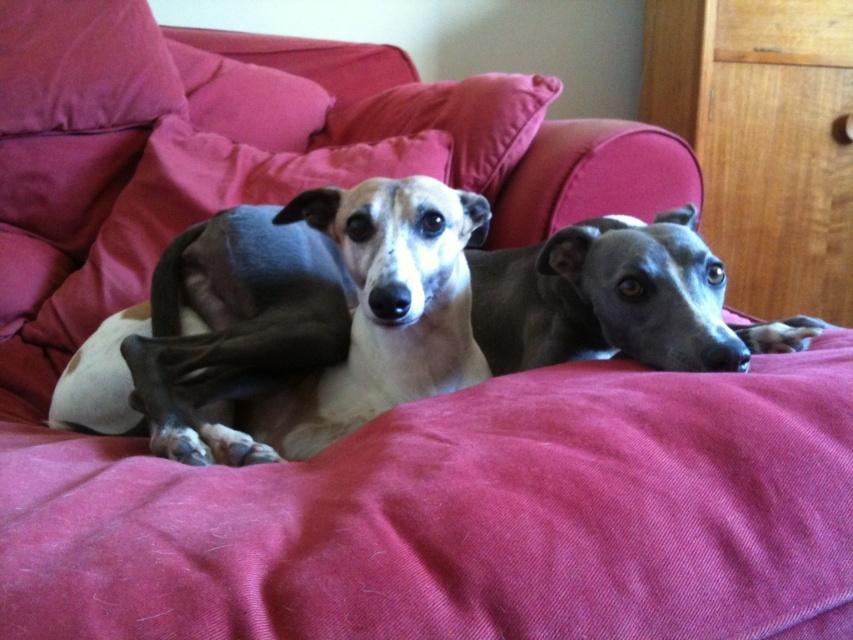
Consider the image. You are trying to decide whether to place a new toy on the couch where the light brown fur at center and the velvety pink pillow at left are located. Based on their heights, which object would the toy be placed on top of?

The light brown fur at center has a lesser height compared to the velvety pink pillow at left, so the toy would be placed on top of the velvety pink pillow at left since it is taller.

You are trying to place a new throw blanket on the couch. The blanket is 1 meter wide. The couch has a length of 2 meters. You see the light brown fur at center and the velvety pink pillow at left. Can the blanket fit horizontally across the couch between these two objects?

The light brown fur at center is positioned on the right side of the velvety pink pillow at left, so the distance between them is less than 1 meter. Therefore, the throw blanket cannot fit horizontally between the light brown fur at center and the velvety pink pillow at left.